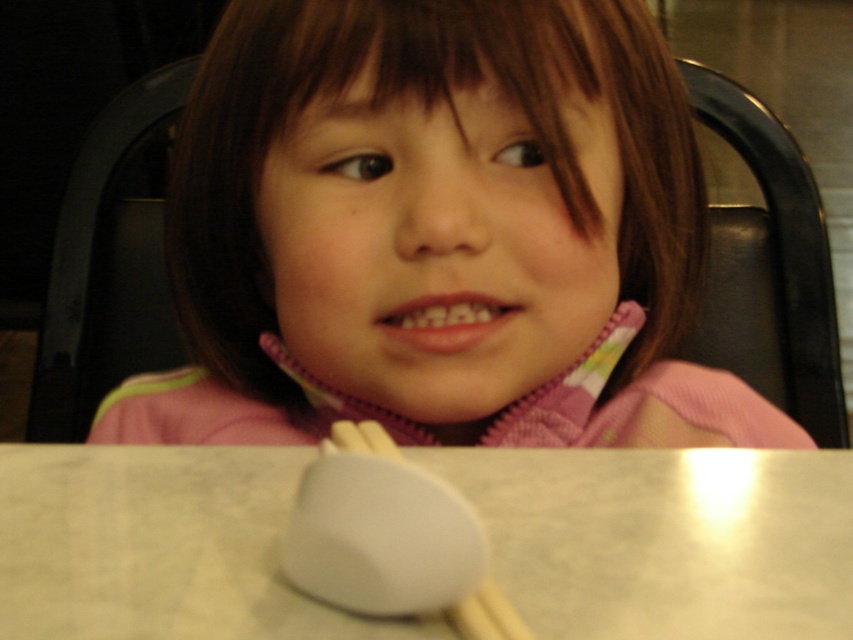
Can you confirm if black plastic chair at upper left is thinner than pink matte teeth at center?

Incorrect, black plastic chair at upper left's width is not less than pink matte teeth at center's.

Between black plastic chair at upper left and pink matte teeth at center, which one has more height?

With more height is black plastic chair at upper left.

What do you see at coordinates (106, 269) in the screenshot? The image size is (853, 640). I see `black plastic chair at upper left` at bounding box center [106, 269].

What are the coordinates of `black plastic chair at upper left` in the screenshot? It's located at (106, 269).

Which is more to the left, pink matte teeth at center or white wood chopstick at lower center?

From the viewer's perspective, white wood chopstick at lower center appears more on the left side.

Does pink matte teeth at center appear on the right side of white wood chopstick at lower center?

Indeed, pink matte teeth at center is positioned on the right side of white wood chopstick at lower center.

You are a GUI agent. You are given a task and a screenshot of the screen. Output one action in this format:
    pyautogui.click(x=<x>, y=<y>)
    Task: Click on the pink matte teeth at center
    Image resolution: width=853 pixels, height=640 pixels.
    Given the screenshot: What is the action you would take?
    pyautogui.click(x=445, y=321)

Is point (815, 362) farther from viewer compared to point (113, 323)?

No.

Identify the location of black leather chair at upper right. (769, 268).